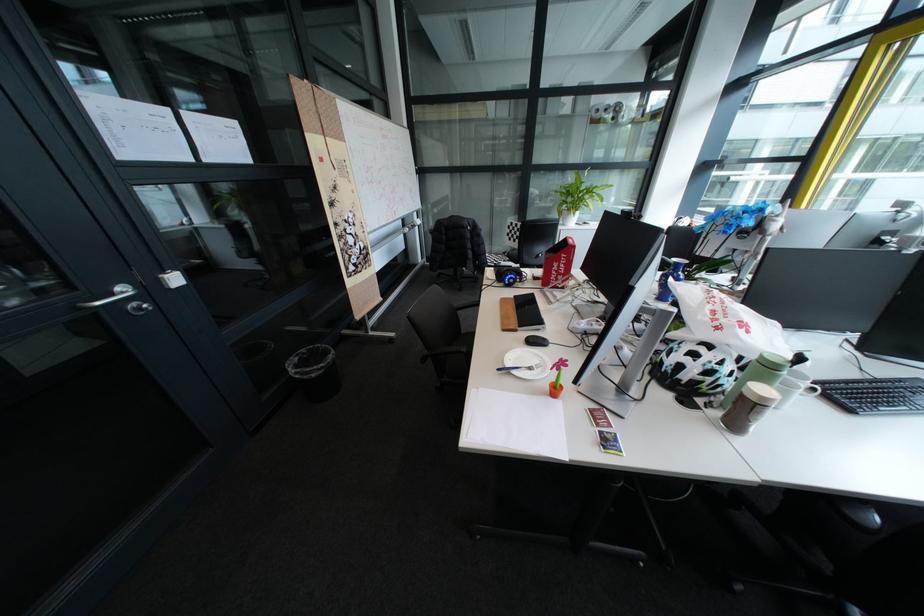
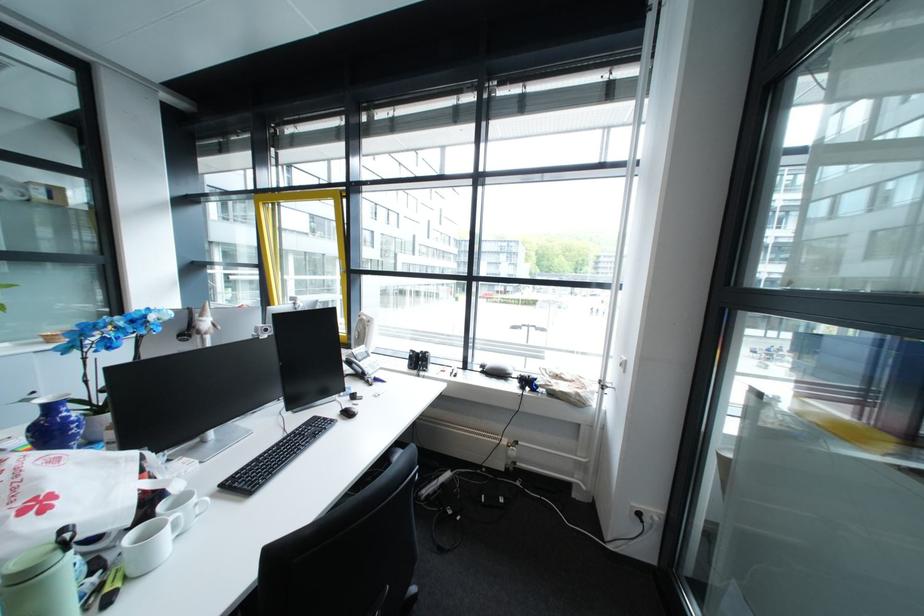
Question: The camera is either moving clockwise (left) or counter-clockwise (right) around the object. The first image is from the beginning of the video and the second image is from the end. Is the camera moving left or right when shooting the video?

Choices:
 (A) Left
 (B) Right

Answer: (A)